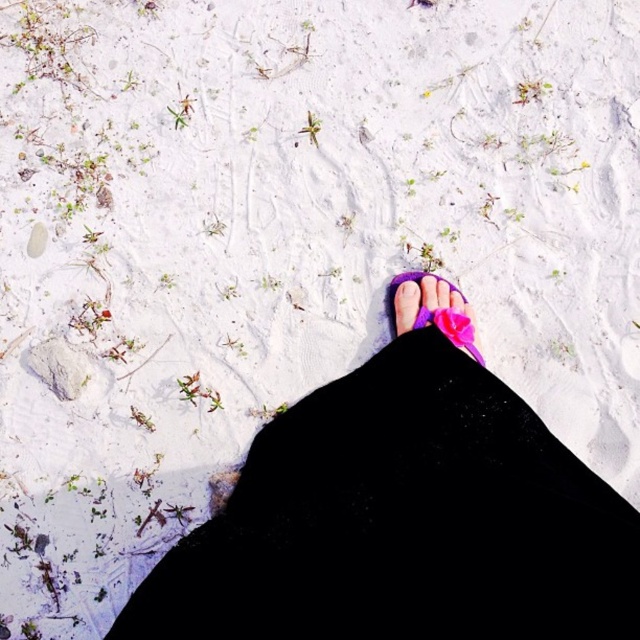
You are a photographer trying to capture the texture of the sand in the image. You notice the purple fabric pants at center and the purple fabric sandal at center. Which object is closer to the camera based on their positions?

The purple fabric sandal at center is closer to the camera because it is above the purple fabric pants at center, indicating it is positioned nearer in the scene.

In the scene shown: You are a fashion designer analyzing the image. You need to determine which item has a bigger surface area between the purple fabric pants at center and the purple fabric sandal at center. Which one is it?

The purple fabric pants at center has a larger size compared to the purple fabric sandal at center, so the purple fabric pants at center has a bigger surface area.